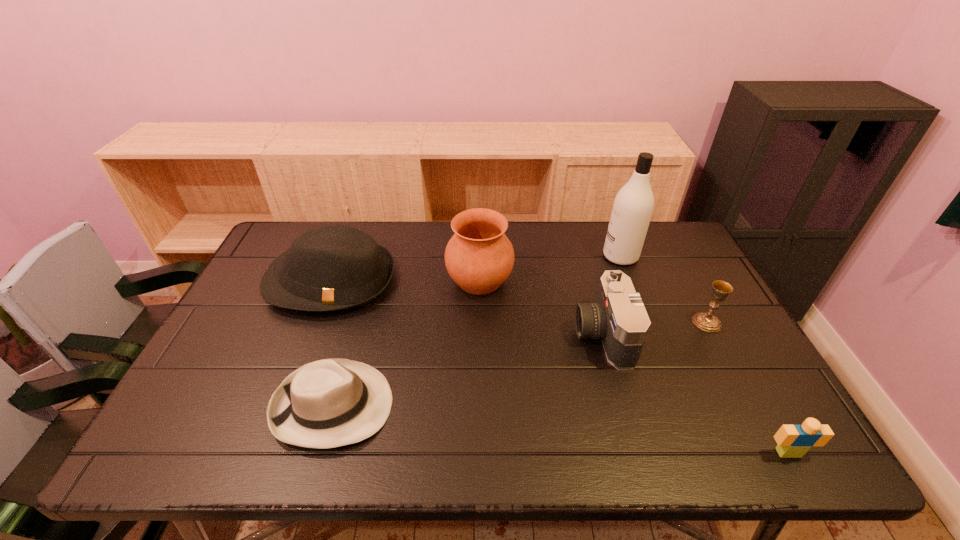
Locate an element on the screen. The image size is (960, 540). free location located 0.340m on the front-facing side of the shampoo is located at coordinates (500, 256).

Image resolution: width=960 pixels, height=540 pixels. Identify the location of free space located 0.290m on the right of the second tallest object. (606, 280).

Identify the location of free space located 0.140m on the front-facing side of the farther fedora. This screenshot has width=960, height=540. (301, 359).

In order to click on free space located on the front-facing side of the camera in this screenshot , I will do `click(440, 334)`.

Find the location of a particular element. This screenshot has width=960, height=540. vacant space located 0.260m on the front-facing side of the camera is located at coordinates (480, 334).

Identify the location of vacant space situated on the front-facing side of the camera. The image size is (960, 540). (432, 334).

Find the location of a particular element. free space located on the back of the chalice is located at coordinates (674, 260).

Where is `free location located on the front-facing side of the shorter fedora`? free location located on the front-facing side of the shorter fedora is located at coordinates (512, 406).

At what (x,y) coordinates should I click in order to perform the action: click on shampoo that is at the far edge. Please return your answer as a coordinate pair (x, y). This screenshot has height=540, width=960. Looking at the image, I should click on (632, 209).

Locate an element on the screen. The image size is (960, 540). pottery at the far edge is located at coordinates (479, 257).